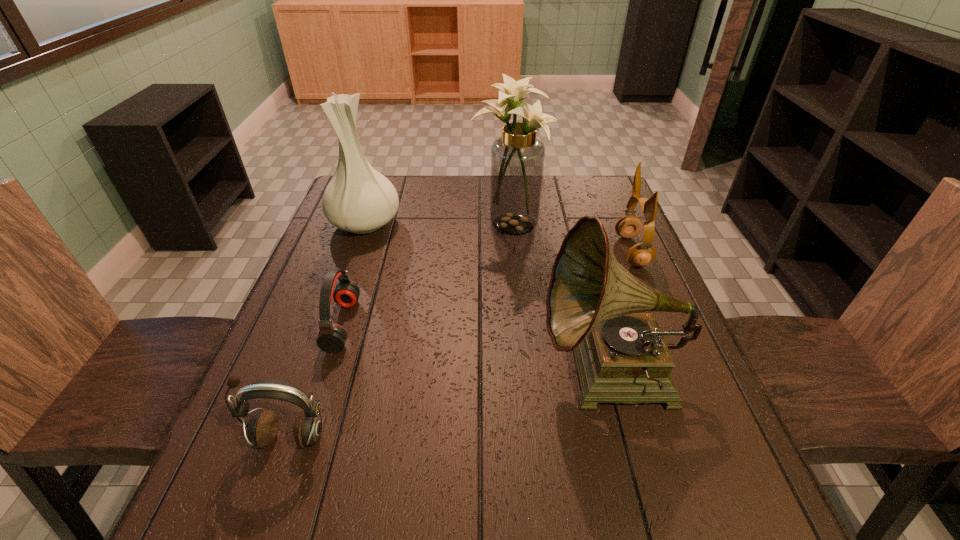
Locate an element on the screen. The height and width of the screenshot is (540, 960). vacant space situated 0.400m on the front of the vase is located at coordinates (317, 361).

The height and width of the screenshot is (540, 960). What are the coordinates of `vacant space located from the horn of the record player` in the screenshot? It's located at pos(450,374).

This screenshot has height=540, width=960. I want to click on vacant space situated 0.360m from the horn of the record player, so click(360, 374).

Where is `free space located 0.180m from the horn of the record player`? free space located 0.180m from the horn of the record player is located at coordinates (450, 374).

Find the location of a particular element. The image size is (960, 540). blank space located on the front-facing side of the tallest earphone is located at coordinates (547, 251).

Where is `vacant area situated on the front-facing side of the tallest earphone`? This screenshot has height=540, width=960. vacant area situated on the front-facing side of the tallest earphone is located at coordinates (537, 251).

Find the location of `blank space located on the front-facing side of the tallest earphone`. blank space located on the front-facing side of the tallest earphone is located at coordinates (537, 251).

At what (x,y) coordinates should I click in order to perform the action: click on vacant space situated on the ear pads of the fifth tallest object. Please return your answer as a coordinate pair (x, y). This screenshot has width=960, height=540. Looking at the image, I should click on (268, 498).

Where is `free spot located 0.240m on the ear cups of the shortest earphone`? free spot located 0.240m on the ear cups of the shortest earphone is located at coordinates (463, 325).

This screenshot has width=960, height=540. Identify the location of flower arrangement present at the far edge. (517, 158).